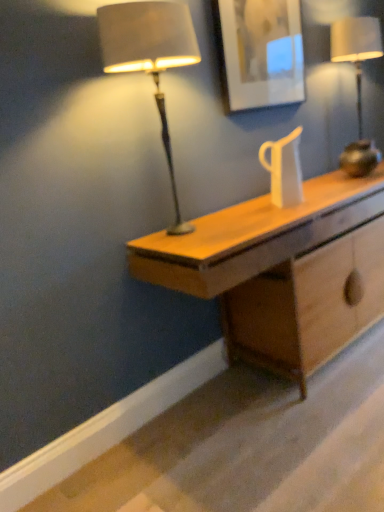
Question: Considering their positions, is metallic gold lamp at right, acting as the 1th lamp starting from the back, located in front of or behind matte brown lamp at left, the 2th lamp from the back?

Choices:
 (A) front
 (B) behind

Answer: (B)

Question: From a real-world perspective, is metallic gold lamp at right, acting as the 1th lamp starting from the back, physically located above or below matte brown lamp at left, placed as the 2th lamp when sorted from right to left?

Choices:
 (A) below
 (B) above

Answer: (A)

Question: Which is farther from the matte white picture frame at upper center?

Choices:
 (A) light wood desk at center
 (B) matte brown lamp at left, positioned as the 1th lamp in left-to-right order
 (C) metallic gold lamp at right, acting as the 1th lamp starting from the back

Answer: (A)

Question: Which is nearer to the light wood desk at center?

Choices:
 (A) matte white picture frame at upper center
 (B) matte brown lamp at left, positioned as the 1th lamp in left-to-right order
 (C) metallic gold lamp at right, marked as the 2th lamp in a left-to-right arrangement

Answer: (B)